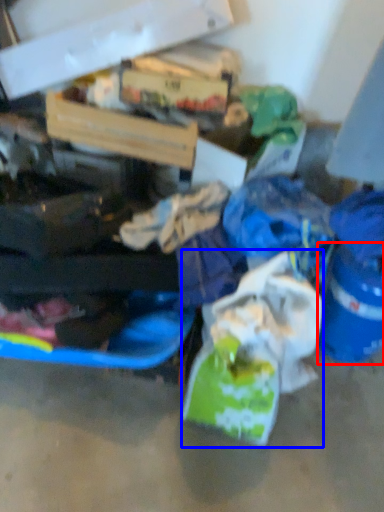
Question: Which point is closer to the camera, bucket (highlighted by a red box) or plastic bag (highlighted by a blue box)?

Choices:
 (A) bucket
 (B) plastic bag

Answer: (B)